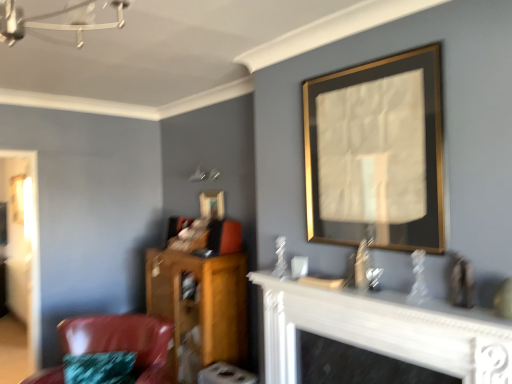
Image resolution: width=512 pixels, height=384 pixels. Describe the element at coordinates (377, 151) in the screenshot. I see `gold/metallic picture frame at upper right, which is the 1th picture frame from right to left` at that location.

At what (x,y) coordinates should I click in order to perform the action: click on gold/metallic picture frame at upper right, arranged as the first picture frame when viewed from the front. Please return your answer as a coordinate pair (x, y). Image resolution: width=512 pixels, height=384 pixels. Looking at the image, I should click on point(377,151).

How many degrees apart are the facing directions of gold/metallic picture frame at upper right, acting as the 2th picture frame starting from the left, and gold-framed mirror at upper center, which appears as the first picture frame when viewed from the back?

The angle between the facing direction of gold/metallic picture frame at upper right, acting as the 2th picture frame starting from the left, and the facing direction of gold-framed mirror at upper center, which appears as the first picture frame when viewed from the back, is 0.938 degrees.

Is gold/metallic picture frame at upper right, which is the 1th picture frame from right to left, to the right of gold-framed mirror at upper center, acting as the 2th picture frame starting from the front, from the viewer's perspective?

Correct, you'll find gold/metallic picture frame at upper right, which is the 1th picture frame from right to left, to the right of gold-framed mirror at upper center, acting as the 2th picture frame starting from the front.

From a real-world perspective, who is located higher, gold/metallic picture frame at upper right, which is the second picture frame in back-to-front order, or gold-framed mirror at upper center, acting as the 2th picture frame starting from the front?

gold/metallic picture frame at upper right, which is the second picture frame in back-to-front order.

Is gold/metallic picture frame at upper right, which is the 1th picture frame from right to left, touching gold-framed mirror at upper center, acting as the 2th picture frame starting from the front?

No, gold/metallic picture frame at upper right, which is the 1th picture frame from right to left, is not beside gold-framed mirror at upper center, acting as the 2th picture frame starting from the front.

Locate an element on the screen. The image size is (512, 384). furniture behind the white glossy fireplace at lower center is located at coordinates (200, 308).

Would you say wooden cabinet at lower left is inside or outside white glossy fireplace at lower center?

wooden cabinet at lower left is not inside white glossy fireplace at lower center, it's outside.

Looking at this image, which point is more distant from viewer, (245, 318) or (289, 323)?

The point (245, 318) is more distant.

Considering their positions, is wooden cabinet at lower left located in front of or behind white glossy fireplace at lower center?

wooden cabinet at lower left is positioned farther from the viewer than white glossy fireplace at lower center.

Which object is positioned more to the right, gold/metallic picture frame at upper right, which is the 1th picture frame from right to left, or wooden cabinet at lower left?

gold/metallic picture frame at upper right, which is the 1th picture frame from right to left, is more to the right.

Considering the positions of objects gold/metallic picture frame at upper right, arranged as the first picture frame when viewed from the front, and wooden cabinet at lower left in the image provided, who is behind, gold/metallic picture frame at upper right, arranged as the first picture frame when viewed from the front, or wooden cabinet at lower left?

wooden cabinet at lower left is behind.

From the image's perspective, count 2nd picture frames upward from the wooden cabinet at lower left and point to it. Please provide its 2D coordinates.

[(377, 151)]

Is gold/metallic picture frame at upper right, acting as the 2th picture frame starting from the left, smaller than wooden cabinet at lower left?

Indeed, gold/metallic picture frame at upper right, acting as the 2th picture frame starting from the left, has a smaller size compared to wooden cabinet at lower left.

Locate an element on the screen. Image resolution: width=512 pixels, height=384 pixels. fireplace in front of the shiny leather chair at lower left is located at coordinates (382, 330).

Between white glossy fireplace at lower center and shiny leather chair at lower left, which one has smaller size?

With smaller size is white glossy fireplace at lower center.

Who is taller, white glossy fireplace at lower center or shiny leather chair at lower left?

white glossy fireplace at lower center is taller.

From a real-world perspective, which object stands above the other?

From a 3D spatial view, white glossy fireplace at lower center is above.

Which of these two, gold/metallic picture frame at upper right, acting as the 2th picture frame starting from the left, or shiny leather chair at lower left, stands shorter?

With less height is shiny leather chair at lower left.

Where is `the 2nd picture frame to the right when counting from the shiny leather chair at lower left`? This screenshot has width=512, height=384. the 2nd picture frame to the right when counting from the shiny leather chair at lower left is located at coordinates (377, 151).

Based on their positions, is gold/metallic picture frame at upper right, arranged as the first picture frame when viewed from the front, located to the left or right of shiny leather chair at lower left?

gold/metallic picture frame at upper right, arranged as the first picture frame when viewed from the front, is to the right of shiny leather chair at lower left.

Is gold/metallic picture frame at upper right, which is the 1th picture frame from right to left, inside or outside of shiny leather chair at lower left?

gold/metallic picture frame at upper right, which is the 1th picture frame from right to left, cannot be found inside shiny leather chair at lower left.

From a real-world perspective, between shiny leather chair at lower left and gold-framed mirror at upper center, acting as the 2th picture frame starting from the front, who is vertically lower?

shiny leather chair at lower left is physically lower.

Choose the correct answer: Is shiny leather chair at lower left inside gold-framed mirror at upper center, which appears as the first picture frame when viewed from the back, or outside it?

shiny leather chair at lower left is not inside gold-framed mirror at upper center, which appears as the first picture frame when viewed from the back, it's outside.

Is shiny leather chair at lower left positioned with its back to gold-framed mirror at upper center, which appears as the first picture frame when viewed from the back?

No, gold-framed mirror at upper center, which appears as the first picture frame when viewed from the back, is not at the back of shiny leather chair at lower left.

Consider the image. Which point is more distant from viewer, (x=52, y=378) or (x=220, y=207)?

Positioned behind is point (x=220, y=207).

From a real-world perspective, does white glossy fireplace at lower center sit lower than wooden cabinet at lower left?

No, from a real-world perspective, white glossy fireplace at lower center is not beneath wooden cabinet at lower left.

Considering their positions, is white glossy fireplace at lower center located in front of or behind wooden cabinet at lower left?

white glossy fireplace at lower center is positioned closer to the viewer than wooden cabinet at lower left.

I want to click on picture frame located in front of the gold-framed mirror at upper center, which appears as the first picture frame when viewed from the back, so click(377, 151).

Locate an element on the screen. fireplace on the right of wooden cabinet at lower left is located at coordinates (382, 330).

Which object lies nearer to the anchor point gold-framed mirror at upper center, positioned as the 1th picture frame in left-to-right order, wooden cabinet at lower left or white glossy fireplace at lower center?

wooden cabinet at lower left lies closer to gold-framed mirror at upper center, positioned as the 1th picture frame in left-to-right order, than the other object.

When comparing their distances from white glossy fireplace at lower center, does gold-framed mirror at upper center, positioned as the 1th picture frame in left-to-right order, or shiny leather chair at lower left seem further?

gold-framed mirror at upper center, positioned as the 1th picture frame in left-to-right order, is positioned further to the anchor white glossy fireplace at lower center.

Looking at the image, which one is located further to gold-framed mirror at upper center, acting as the 2th picture frame starting from the front, gold/metallic picture frame at upper right, acting as the 2th picture frame starting from the left, or wooden cabinet at lower left?

gold/metallic picture frame at upper right, acting as the 2th picture frame starting from the left.

Estimate the real-world distances between objects in this image. Which object is closer to gold-framed mirror at upper center, placed as the 2th picture frame when sorted from right to left, shiny leather chair at lower left or wooden cabinet at lower left?

Among the two, wooden cabinet at lower left is located nearer to gold-framed mirror at upper center, placed as the 2th picture frame when sorted from right to left.

Estimate the real-world distances between objects in this image. Which object is further from gold/metallic picture frame at upper right, acting as the 2th picture frame starting from the left, white glossy fireplace at lower center or wooden cabinet at lower left?

The object further to gold/metallic picture frame at upper right, acting as the 2th picture frame starting from the left, is wooden cabinet at lower left.

Based on their spatial positions, is white glossy fireplace at lower center or gold-framed mirror at upper center, positioned as the 1th picture frame in left-to-right order, closer to wooden cabinet at lower left?

Among the two, gold-framed mirror at upper center, positioned as the 1th picture frame in left-to-right order, is located nearer to wooden cabinet at lower left.

Estimate the real-world distances between objects in this image. Which object is closer to wooden cabinet at lower left, shiny leather chair at lower left or white glossy fireplace at lower center?

Based on the image, shiny leather chair at lower left appears to be nearer to wooden cabinet at lower left.

Looking at the image, which one is located further to shiny leather chair at lower left, wooden cabinet at lower left or white glossy fireplace at lower center?

white glossy fireplace at lower center lies further to shiny leather chair at lower left than the other object.

Where is `picture frame positioned between white glossy fireplace at lower center and wooden cabinet at lower left from near to far`? The width and height of the screenshot is (512, 384). picture frame positioned between white glossy fireplace at lower center and wooden cabinet at lower left from near to far is located at coordinates (377, 151).

Identify the location of furniture between gold/metallic picture frame at upper right, which is the second picture frame in back-to-front order, and gold-framed mirror at upper center, which appears as the first picture frame when viewed from the back, from front to back. Image resolution: width=512 pixels, height=384 pixels. (200, 308).

You are a GUI agent. You are given a task and a screenshot of the screen. Output one action in this format:
    pyautogui.click(x=<x>, y=<y>)
    Task: Click on the furniture between white glossy fireplace at lower center and gold-framed mirror at upper center, acting as the 2th picture frame starting from the front, from front to back
    The width and height of the screenshot is (512, 384).
    Given the screenshot: What is the action you would take?
    pyautogui.click(x=200, y=308)

Find the location of `picture frame between white glossy fireplace at lower center and gold-framed mirror at upper center, positioned as the 1th picture frame in left-to-right order, from front to back`. picture frame between white glossy fireplace at lower center and gold-framed mirror at upper center, positioned as the 1th picture frame in left-to-right order, from front to back is located at coordinates (377, 151).